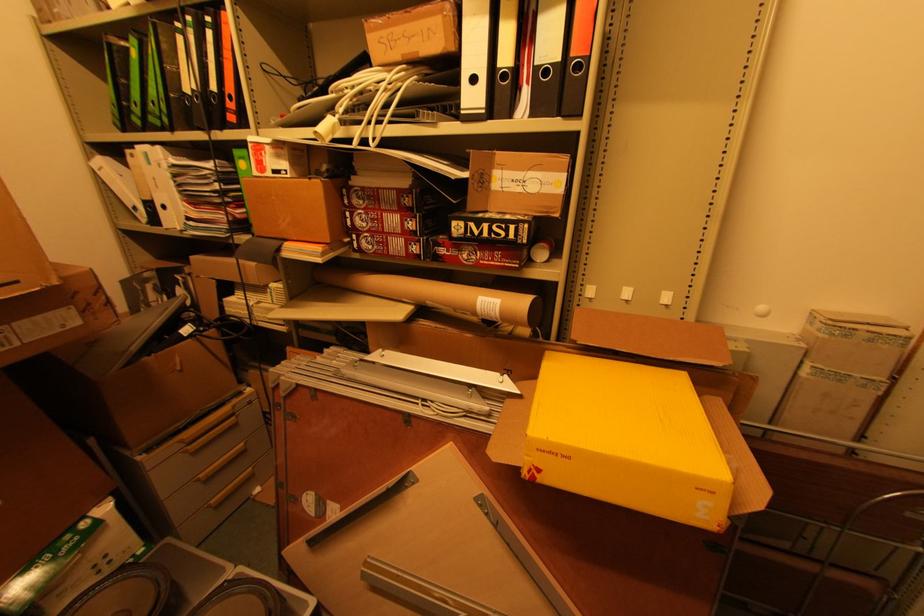
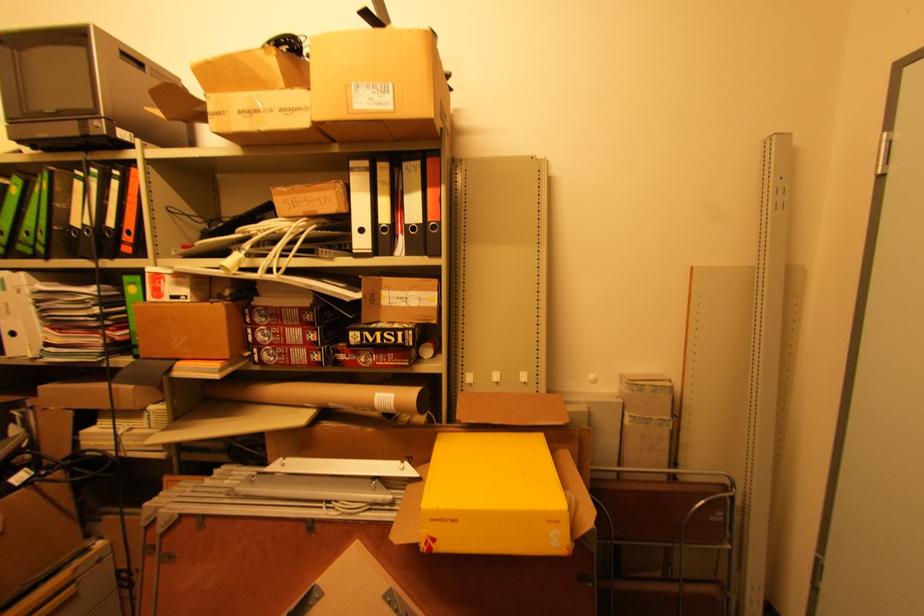
Where in the second image is the point corresponding to point (502, 66) from the first image?

(383, 223)